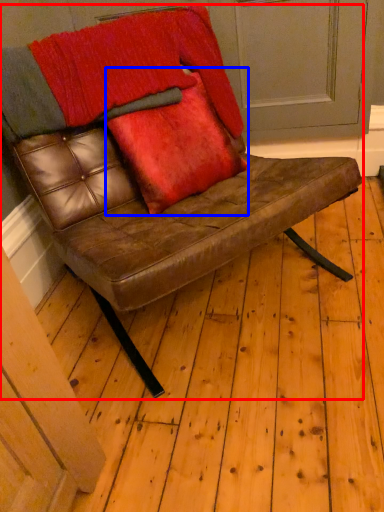
Question: Which object is closer to the camera taking this photo, chair (highlighted by a red box) or throw pillow (highlighted by a blue box)?

Choices:
 (A) chair
 (B) throw pillow

Answer: (A)